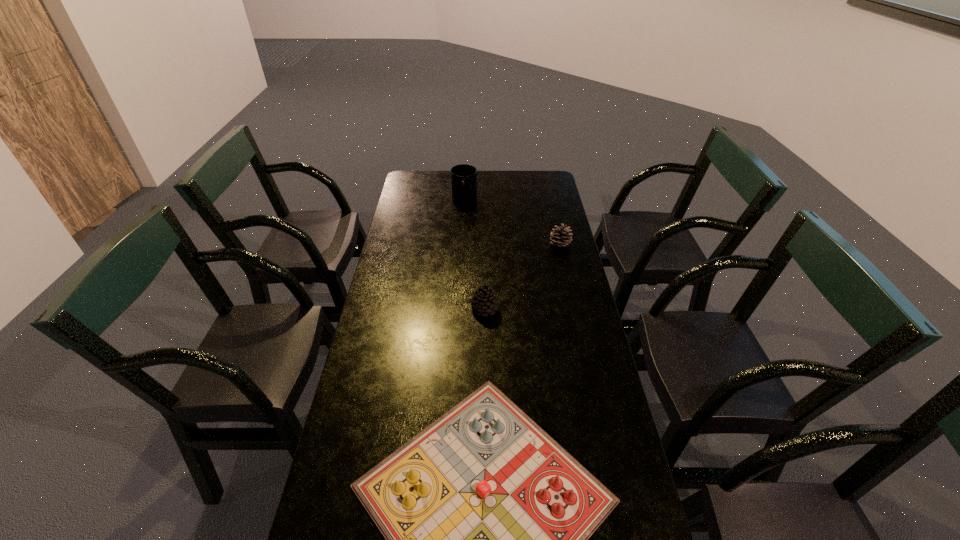
Where is `object positioned at the right edge`? object positioned at the right edge is located at coordinates (560, 237).

In the image, there is a desktop. At what (x,y) coordinates should I click in order to perform the action: click on free space at the far edge. Please return your answer as a coordinate pair (x, y). The height and width of the screenshot is (540, 960). Looking at the image, I should click on (489, 194).

Where is `free location at the left edge`? The height and width of the screenshot is (540, 960). free location at the left edge is located at coordinates (364, 449).

This screenshot has width=960, height=540. In the image, there is a desktop. In order to click on vacant space at the right edge in this screenshot , I will do `click(556, 333)`.

Locate an element on the screen. free space that is in between the second farthest object and the nearer pinecone is located at coordinates (522, 276).

Where is `free spot between the farther pinecone and the second nearest object`? Image resolution: width=960 pixels, height=540 pixels. free spot between the farther pinecone and the second nearest object is located at coordinates (522, 276).

Find the location of `free space between the right pinecone and the third farthest object`. free space between the right pinecone and the third farthest object is located at coordinates (522, 276).

Identify the location of free point between the mug and the farther pinecone. The width and height of the screenshot is (960, 540). (513, 222).

Locate an element on the screen. object that is the second closest one to the second nearest object is located at coordinates (560, 237).

Locate an element on the screen. Image resolution: width=960 pixels, height=540 pixels. object that is the second closest one to the shortest object is located at coordinates point(560,237).